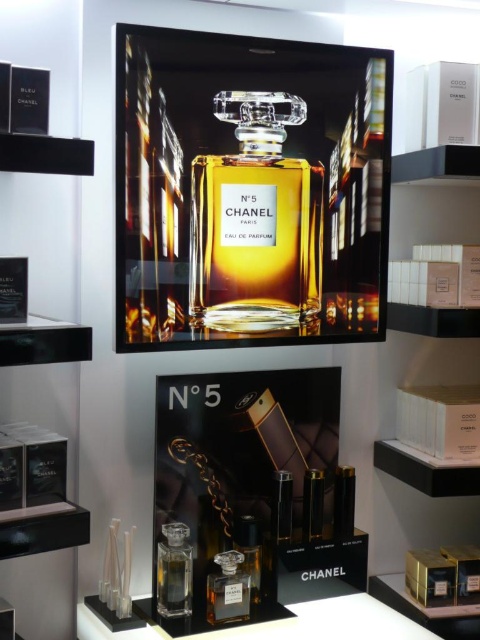
You are a customer in a luxury store and see the Chanel No. 5 display. There is a point marked at coordinates (255, 221). Which object is this point located on?

The point marked at coordinates (255, 221) is located on the matte glass perfume bottle at center.

You are a customer at a perfume store looking at the Chanel No. 5 display. You see a matte glass perfume bottle at center and a transparent glass perfume at lower center. Which one is located to the right of the other?

The matte glass perfume bottle at center is positioned on the right side of transparent glass perfume at lower center.

Consider the image. You are a customer in a luxury store and see the Chanel No. 5 display. There is a point marked at coordinates (255, 221). What does this point indicate?

The point at coordinates (255, 221) marks the location of the matte glass perfume bottle at center.